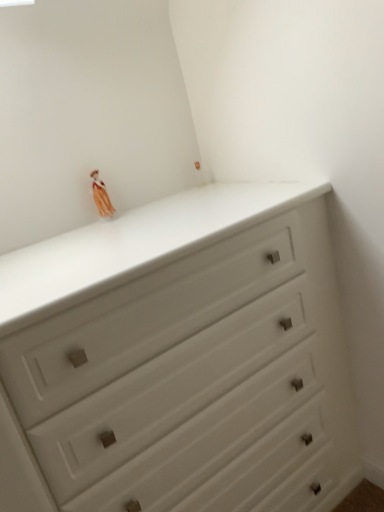
What are the coordinates of `vacant area on top of white matte chest of drawers at upper center (from a real-world perspective)` in the screenshot? It's located at (131, 227).